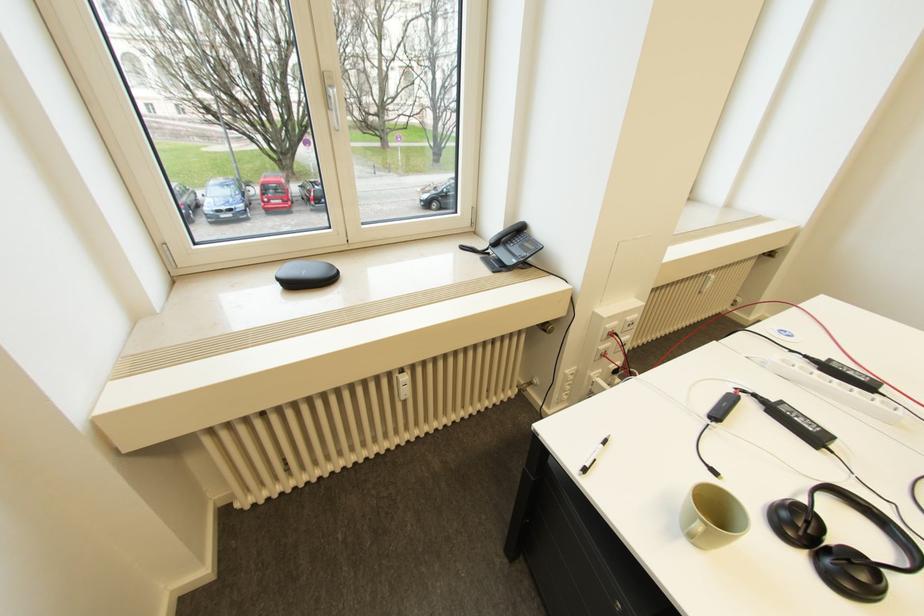
What are the coordinates of `radiator thermostat knob` in the screenshot? It's located at (402, 386).